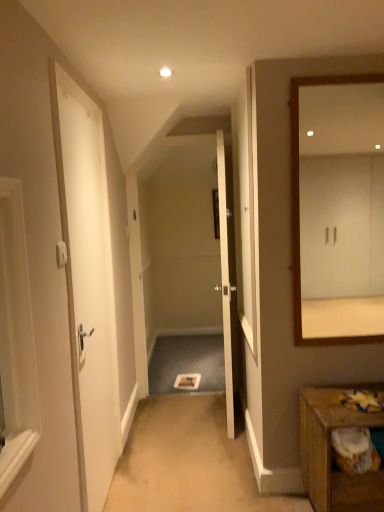
Measure the distance between wooden table at lower right and camera.

wooden table at lower right is 5.71 feet from camera.

In order to click on white matte door at left, which is the 2th door in back-to-front order in this screenshot , I will do `click(88, 288)`.

Does white glossy door at center, the first door viewed from the back, contain wooden table at lower right?

No, wooden table at lower right is not a part of white glossy door at center, the first door viewed from the back.

From a real-world perspective, who is located higher, white glossy door at center, the first door from the right, or wooden table at lower right?

white glossy door at center, the first door from the right, from a real-world perspective.

Where is `door that is the 2nd one above the wooden table at lower right (from a real-world perspective)`? The height and width of the screenshot is (512, 384). door that is the 2nd one above the wooden table at lower right (from a real-world perspective) is located at coordinates click(227, 273).

Which object is positioned more to the left, white glossy door at center, the first door viewed from the back, or wooden table at lower right?

Positioned to the left is white glossy door at center, the first door viewed from the back.

In the scene shown: How distant is wooden table at lower right from white wooden mirror at right?

The distance of wooden table at lower right from white wooden mirror at right is 2.22 meters.

Considering the positions of objects wooden table at lower right and white wooden mirror at right in the image provided, who is in front, wooden table at lower right or white wooden mirror at right?

wooden table at lower right is in front.

Is wooden table at lower right located outside white wooden mirror at right?

Absolutely, wooden table at lower right is external to white wooden mirror at right.

Can you confirm if wooden table at lower right is positioned to the left of white wooden mirror at right?

In fact, wooden table at lower right is to the right of white wooden mirror at right.

Considering the positions of objects wooden table at lower right and white glossy door at center, which is the 2th door in left-to-right order, in the image provided, who is more to the right, wooden table at lower right or white glossy door at center, which is the 2th door in left-to-right order,?

wooden table at lower right is more to the right.

Identify the location of table in front of the white glossy door at center, acting as the 2th door starting from the front. The height and width of the screenshot is (512, 384). (331, 454).

Consider the image. Which of these two, wooden table at lower right or white glossy door at center, which is the 2th door in left-to-right order, is bigger?

white glossy door at center, which is the 2th door in left-to-right order.

Is point (319, 482) in front of point (227, 285)?

Yes, it is in front of point (227, 285).

What are the coordinates of `mirror behind the white matte door at left, placed as the 1th door when sorted from front to back` in the screenshot? It's located at (338, 208).

Is white matte door at left, which is the 2th door in back-to-front order, situated inside white wooden mirror at right or outside?

white matte door at left, which is the 2th door in back-to-front order, is not inside white wooden mirror at right, it's outside.

Based on their sizes in the image, would you say white matte door at left, placed as the 1th door when sorted from front to back, is bigger or smaller than white wooden mirror at right?

Considering their sizes, white matte door at left, placed as the 1th door when sorted from front to back, takes up more space than white wooden mirror at right.

At what (x,y) coordinates should I click in order to perform the action: click on mirror on the right of white glossy door at center, the first door from the right. Please return your answer as a coordinate pair (x, y). Looking at the image, I should click on (338, 208).

Would you say white wooden mirror at right is inside or outside white glossy door at center, which is the 2th door in left-to-right order?

white wooden mirror at right is outside white glossy door at center, which is the 2th door in left-to-right order.

Can you confirm if white wooden mirror at right is wider than white glossy door at center, the first door from the right?

No, white wooden mirror at right is not wider than white glossy door at center, the first door from the right.

Which object is further away from the camera, white wooden mirror at right or white glossy door at center, the first door viewed from the back?

white glossy door at center, the first door viewed from the back, is more distant.

In the scene shown: Considering their positions, is white matte door at left, the 1th door from the left, located in front of or behind wooden table at lower right?

In the image, white matte door at left, the 1th door from the left, appears in front of wooden table at lower right.

Is white matte door at left, which is the 2th door in back-to-front order, far away from wooden table at lower right?

Absolutely, white matte door at left, which is the 2th door in back-to-front order, is distant from wooden table at lower right.

Looking at this image, can you confirm if white matte door at left, arranged as the 2th door when viewed from the right, is taller than wooden table at lower right?

Yes.

From the picture: Is white matte door at left, which is the 2th door in back-to-front order, oriented away from wooden table at lower right?

No, white matte door at left, which is the 2th door in back-to-front order,'s orientation is not away from wooden table at lower right.

Is white glossy door at center, the first door from the right, thinner than white matte door at left, placed as the 1th door when sorted from front to back?

Incorrect, the width of white glossy door at center, the first door from the right, is not less than that of white matte door at left, placed as the 1th door when sorted from front to back.

Considering the sizes of objects white glossy door at center, which is the 2th door in left-to-right order, and white matte door at left, placed as the 1th door when sorted from front to back, in the image provided, who is taller, white glossy door at center, which is the 2th door in left-to-right order, or white matte door at left, placed as the 1th door when sorted from front to back,?

With more height is white matte door at left, placed as the 1th door when sorted from front to back.

Is white glossy door at center, which is the 2th door in left-to-right order, oriented away from white matte door at left, the 1th door from the left?

No, white glossy door at center, which is the 2th door in left-to-right order, is not facing away from white matte door at left, the 1th door from the left.

Find the location of a particular element. table below the white glossy door at center, acting as the 2th door starting from the front (from a real-world perspective) is located at coordinates point(331,454).

I want to click on mirror that appears on the left of wooden table at lower right, so click(x=338, y=208).

From the image, which object appears to be farther from wooden table at lower right, white glossy door at center, which is the 2th door in left-to-right order, or white wooden mirror at right?

white wooden mirror at right.

Looking at the image, which one is located further to white wooden mirror at right, wooden table at lower right or white glossy door at center, the first door from the right?

wooden table at lower right.

Looking at the image, which one is located further to white glossy door at center, the first door viewed from the back, white wooden mirror at right or wooden table at lower right?

white wooden mirror at right.

From the image, which object appears to be farther from wooden table at lower right, white matte door at left, the 1th door from the left, or white wooden mirror at right?

white wooden mirror at right is further to wooden table at lower right.

Considering their positions, is white wooden mirror at right positioned closer to white glossy door at center, the first door viewed from the back, than white matte door at left, the 1th door from the left?

Based on the image, white matte door at left, the 1th door from the left, appears to be nearer to white glossy door at center, the first door viewed from the back.

From the image, which object appears to be nearer to white matte door at left, the 1th door from the left, white wooden mirror at right or white glossy door at center, which is the 2th door in left-to-right order?

white glossy door at center, which is the 2th door in left-to-right order, is positioned closer to the anchor white matte door at left, the 1th door from the left.

Estimate the real-world distances between objects in this image. Which object is closer to wooden table at lower right, white glossy door at center, the first door viewed from the back, or white matte door at left, placed as the 1th door when sorted from front to back?

white glossy door at center, the first door viewed from the back.

From the image, which object appears to be farther from wooden table at lower right, white matte door at left, the 1th door from the left, or white glossy door at center, the first door viewed from the back?

white matte door at left, the 1th door from the left, is further to wooden table at lower right.

At what (x,y) coordinates should I click in order to perform the action: click on door between white matte door at left, the 1th door from the left, and white wooden mirror at right from left to right. Please return your answer as a coordinate pair (x, y). This screenshot has height=512, width=384. Looking at the image, I should click on (227, 273).

Where is `mirror located between white matte door at left, the 1th door from the left, and wooden table at lower right in the left-right direction`? mirror located between white matte door at left, the 1th door from the left, and wooden table at lower right in the left-right direction is located at coordinates (338, 208).

The height and width of the screenshot is (512, 384). Find the location of `door between white matte door at left, arranged as the 2th door when viewed from the right, and wooden table at lower right from left to right`. door between white matte door at left, arranged as the 2th door when viewed from the right, and wooden table at lower right from left to right is located at coordinates (227, 273).